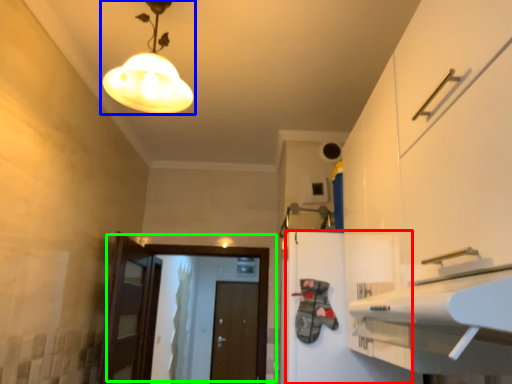
Question: Estimate the real-world distances between objects in this image. Which object is farther from cabinetry (highlighted by a red box), lamp (highlighted by a blue box) or door (highlighted by a green box)?

Choices:
 (A) lamp
 (B) door

Answer: (B)